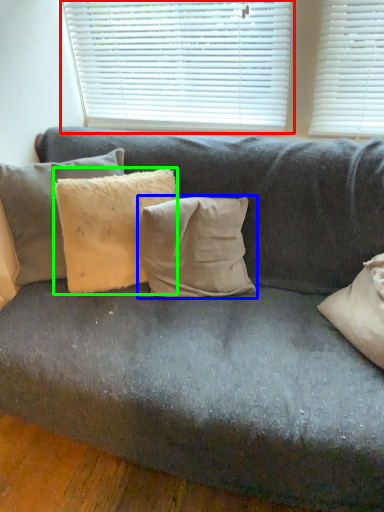
Question: Estimate the real-world distances between objects in this image. Which object is closer to window blind (highlighted by a red box), pillow (highlighted by a blue box) or pillow (highlighted by a green box)?

Choices:
 (A) pillow
 (B) pillow

Answer: (B)